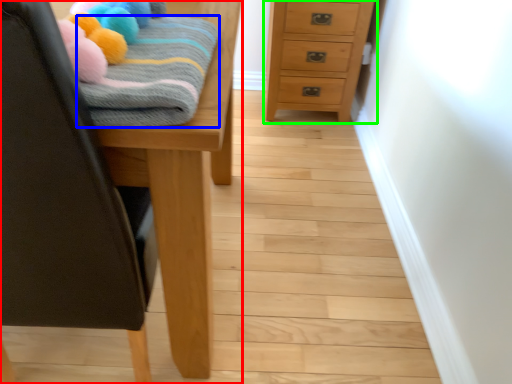
Question: Based on their relative distances, which object is farther from furniture (highlighted by a red box)? Choose from bath towel (highlighted by a blue box) and chest of drawers (highlighted by a green box).

Choices:
 (A) bath towel
 (B) chest of drawers

Answer: (B)